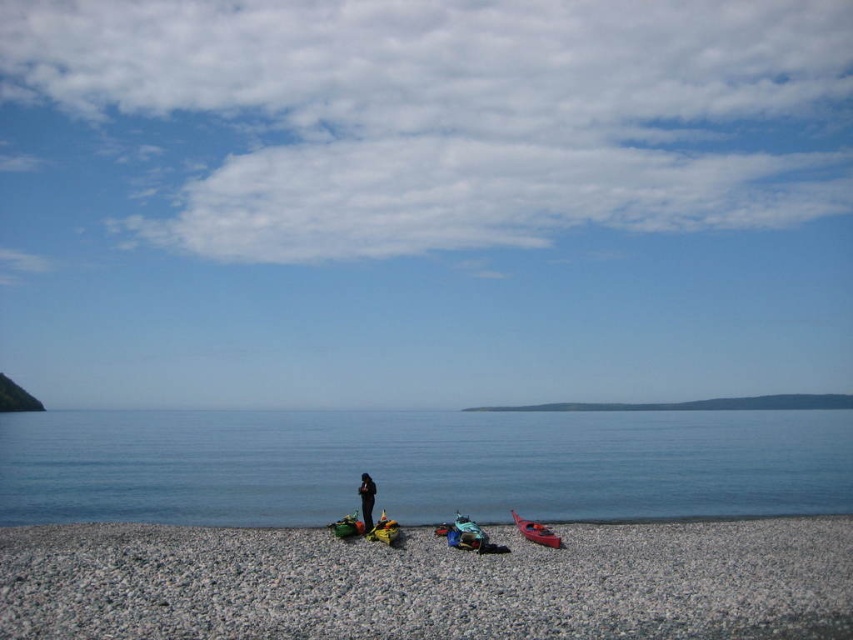
Question: Which point appears closest to the camera in this image?

Choices:
 (A) (468, 557)
 (B) (469, 547)

Answer: (A)

Question: Which of the following is the farthest from the observer?

Choices:
 (A) green plastic boat at lower center
 (B) smooth pebble beach at lower center

Answer: (A)

Question: Is smooth pebble beach at lower center bigger than blue smooth water at center?

Choices:
 (A) yes
 (B) no

Answer: (B)

Question: Is smooth pebble beach at lower center in front of matte red kayak at lower right?

Choices:
 (A) no
 (B) yes

Answer: (B)

Question: Which point is farther to the camera?

Choices:
 (A) (344, 630)
 (B) (457, 531)

Answer: (B)

Question: Can you confirm if blue smooth water at center is bigger than green plastic boat at lower center?

Choices:
 (A) yes
 (B) no

Answer: (A)